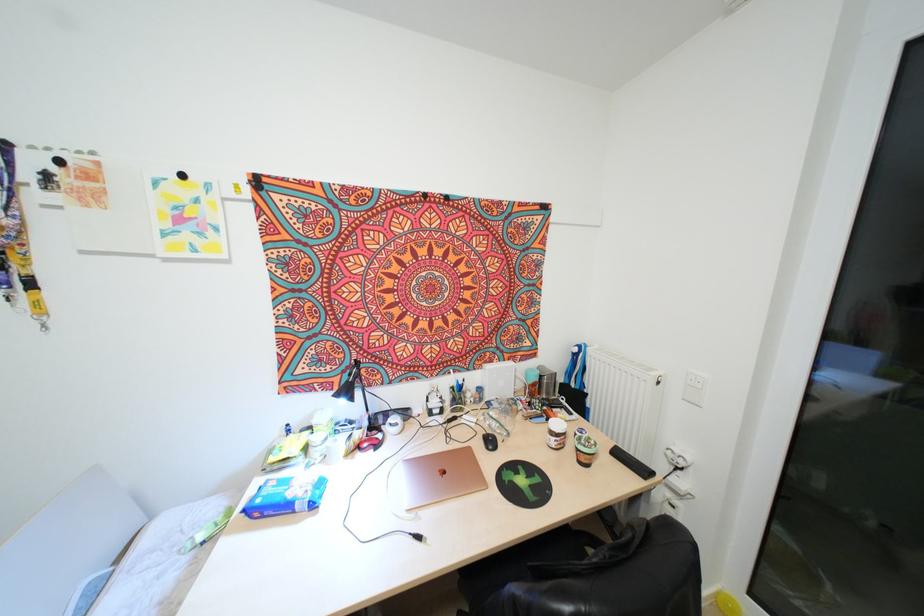
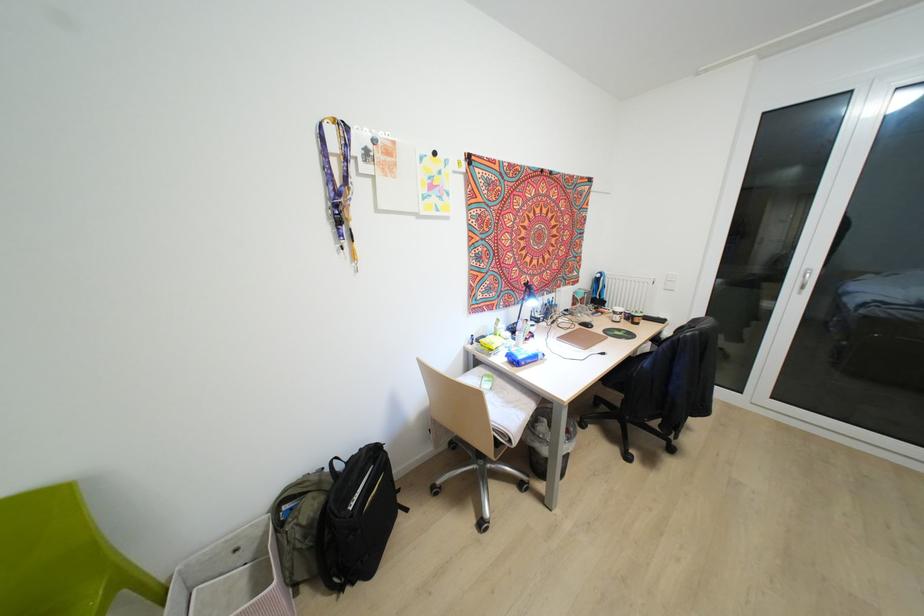
Where in the second image is the point corresponding to pixel 586 464 from the first image?

(637, 323)